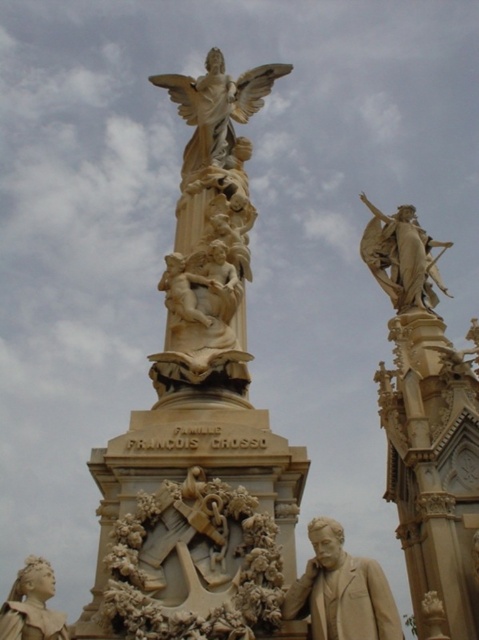
You are standing in front of the monument and want to take a photo of both the matte gold statue at upper right and the matte gold statue at lower left. However, you notice that one of them is partially hidden from your current viewpoint. Which statue is obstructed, and why?

The matte gold statue at lower left is obstructed because it is positioned behind the matte gold statue at upper right from your viewpoint.

You are an art student analyzing the monument. You notice the matte gold statue at upper right and the beige stone statue at lower center. Which statue is taller?

The matte gold statue at upper right is much taller than the beige stone statue at lower center.